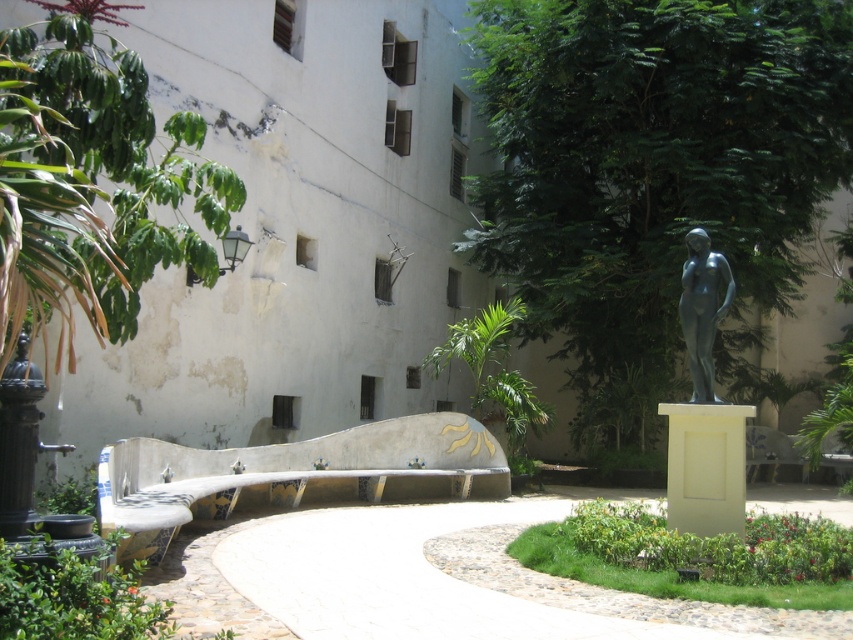
Question: Can you confirm if green leafy tree at center is positioned below green grass at center?

Choices:
 (A) yes
 (B) no

Answer: (B)

Question: Can you confirm if green grass at center is wider than metallic statue at center-right?

Choices:
 (A) no
 (B) yes

Answer: (B)

Question: Which point is farther to the camera?

Choices:
 (A) (799, 582)
 (B) (190, 131)
 (C) (706, 250)

Answer: (B)

Question: Which object is positioned closest to the green leafy plant at upper left?

Choices:
 (A) green leafy tree at center
 (B) green grass at center

Answer: (B)

Question: Is the position of green leafy tree at center more distant than that of metallic statue at center-right?

Choices:
 (A) yes
 (B) no

Answer: (A)

Question: Among these objects, which one is nearest to the camera?

Choices:
 (A) green leafy tree at center
 (B) metallic statue at center-right

Answer: (B)